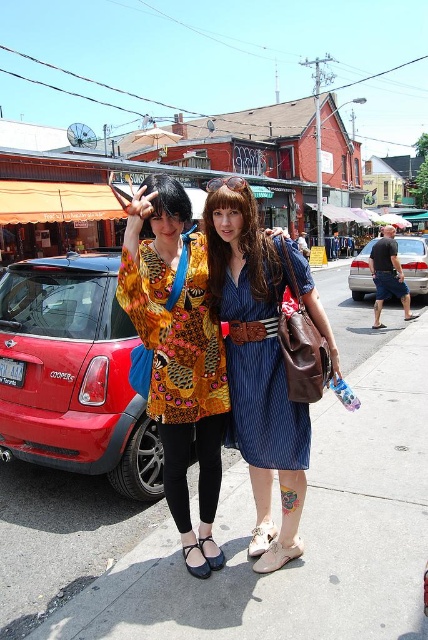
Image resolution: width=428 pixels, height=640 pixels. Describe the element at coordinates (388, 275) in the screenshot. I see `dark blue denim shorts at right` at that location.

Does dark blue denim shorts at right lie behind matte black sandal at lower center?

Yes, it is behind matte black sandal at lower center.

The width and height of the screenshot is (428, 640). Find the location of `dark blue denim shorts at right`. dark blue denim shorts at right is located at coordinates (388, 275).

This screenshot has height=640, width=428. Identify the location of dark blue denim shorts at right. (388, 275).

Is beige suede sandal at lower center thinner than black leather sandal at lower center?

No.

From the picture: Is beige suede sandal at lower center bigger than black leather sandal at lower center?

Indeed, beige suede sandal at lower center has a larger size compared to black leather sandal at lower center.

Who is more forward, (300, 552) or (186, 554)?

Positioned in front is point (300, 552).

Locate an element on the screen. The height and width of the screenshot is (640, 428). beige suede sandal at lower center is located at coordinates (276, 556).

Between printed silk dress at center and matte black sandal at lower center, which one has more height?

printed silk dress at center is taller.

Can you confirm if printed silk dress at center is thinner than matte black sandal at lower center?

No.

Between point (190, 268) and point (210, 570), which one is positioned in front?

Point (190, 268) is more forward.

What are the coordinates of `printed silk dress at center` in the screenshot? It's located at 175,333.